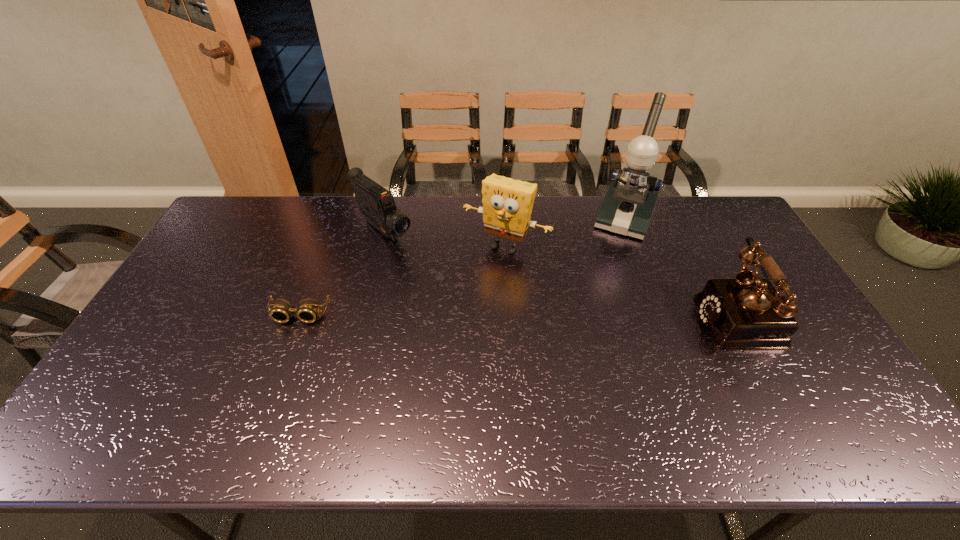
This screenshot has width=960, height=540. Identify the location of the shortest object. (308, 309).

Identify the location of telephone. (747, 312).

In order to click on microscope in this screenshot , I will do `click(628, 205)`.

This screenshot has height=540, width=960. In order to click on the third object from left to right in this screenshot , I will do `click(507, 203)`.

Image resolution: width=960 pixels, height=540 pixels. In order to click on camcorder in this screenshot , I will do `click(376, 203)`.

This screenshot has height=540, width=960. I want to click on vacant space located through the lenses of the goggles, so click(286, 352).

Find the location of a particular element. free spot located on the dial of the telephone is located at coordinates (609, 315).

This screenshot has width=960, height=540. Identify the location of free location located on the dial of the telephone. (585, 315).

At what (x,y) coordinates should I click in order to perform the action: click on free space located on the dial of the telephone. Please return your answer as a coordinate pair (x, y). This screenshot has height=540, width=960. Looking at the image, I should click on (667, 315).

In order to click on vacant space located 0.270m at the eyepiece of the microscope in this screenshot , I will do `click(597, 292)`.